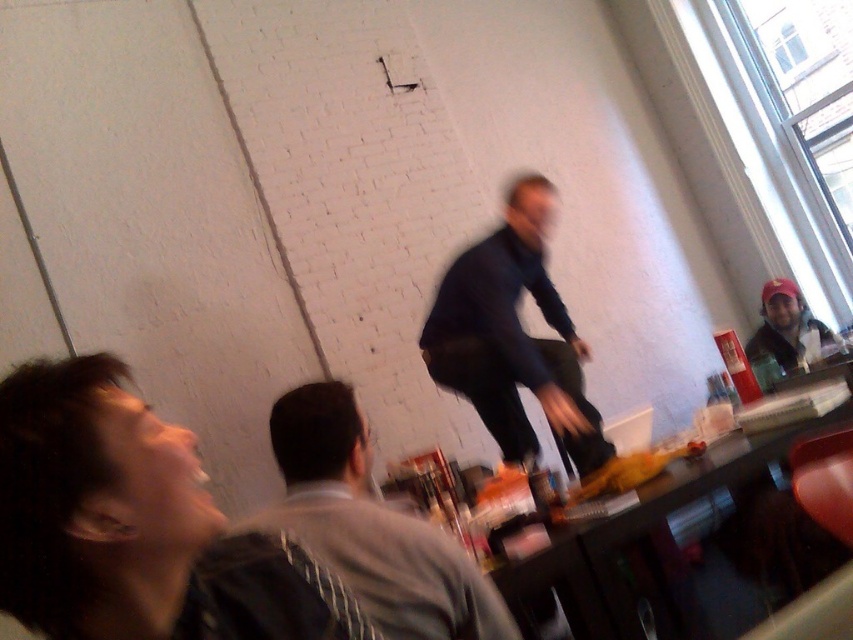
How far apart are gray fabric shirt at center and dark blue fabric pants at center?

4.34 feet

Can you confirm if gray fabric shirt at center is positioned to the right of dark blue fabric pants at center?

In fact, gray fabric shirt at center is to the left of dark blue fabric pants at center.

Who is more forward, [317,484] or [527,248]?

Positioned in front is point [317,484].

Identify the location of gray fabric shirt at center. (370, 525).

Can you confirm if gray fabric shirt at center is smaller than matte black cap at upper right?

Yes, gray fabric shirt at center is smaller than matte black cap at upper right.

How far apart are gray fabric shirt at center and matte black cap at upper right?

8.86 feet

In order to click on gray fabric shirt at center in this screenshot , I will do `click(370, 525)`.

How far apart are dark brown hair at lower left and matte black cap at upper right?

The distance of dark brown hair at lower left from matte black cap at upper right is 3.16 meters.

The width and height of the screenshot is (853, 640). What do you see at coordinates (135, 525) in the screenshot?
I see `dark brown hair at lower left` at bounding box center [135, 525].

Describe the element at coordinates (135, 525) in the screenshot. I see `dark brown hair at lower left` at that location.

Where is `dark brown hair at lower left`? dark brown hair at lower left is located at coordinates (135, 525).